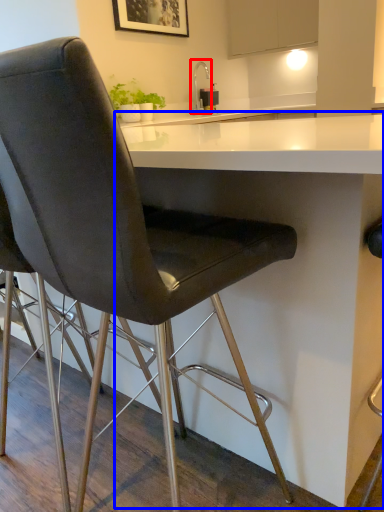
Question: Among these objects, which one is nearest to the camera, faucet (highlighted by a red box) or table (highlighted by a blue box)?

Choices:
 (A) faucet
 (B) table

Answer: (B)